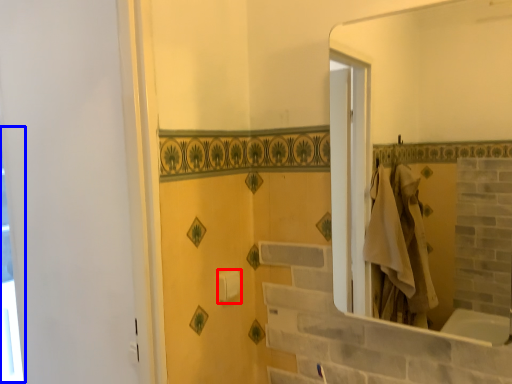
Question: Which object is closer to the camera taking this photo, towel bar (highlighted by a red box) or window (highlighted by a blue box)?

Choices:
 (A) towel bar
 (B) window

Answer: (A)